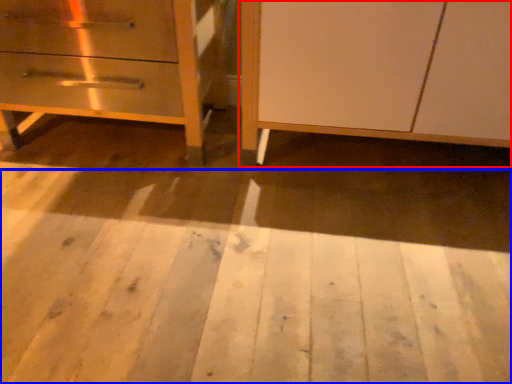
Question: Which point is closer to the camera, furniture (highlighted by a red box) or plywood (highlighted by a blue box)?

Choices:
 (A) furniture
 (B) plywood

Answer: (B)